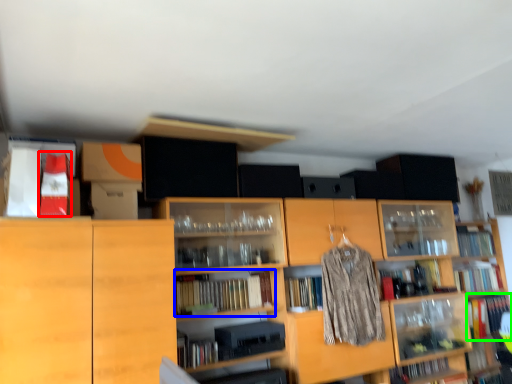
Question: Which is farther away from book (highlighted by a red box)? book (highlighted by a blue box) or book (highlighted by a green box)?

Choices:
 (A) book
 (B) book

Answer: (B)